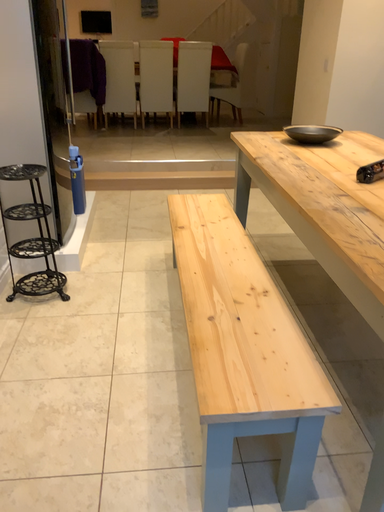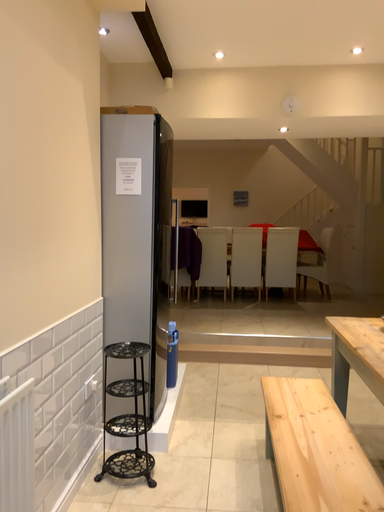
Question: Which way did the camera rotate in the video?

Choices:
 (A) rotated right
 (B) rotated left

Answer: (B)